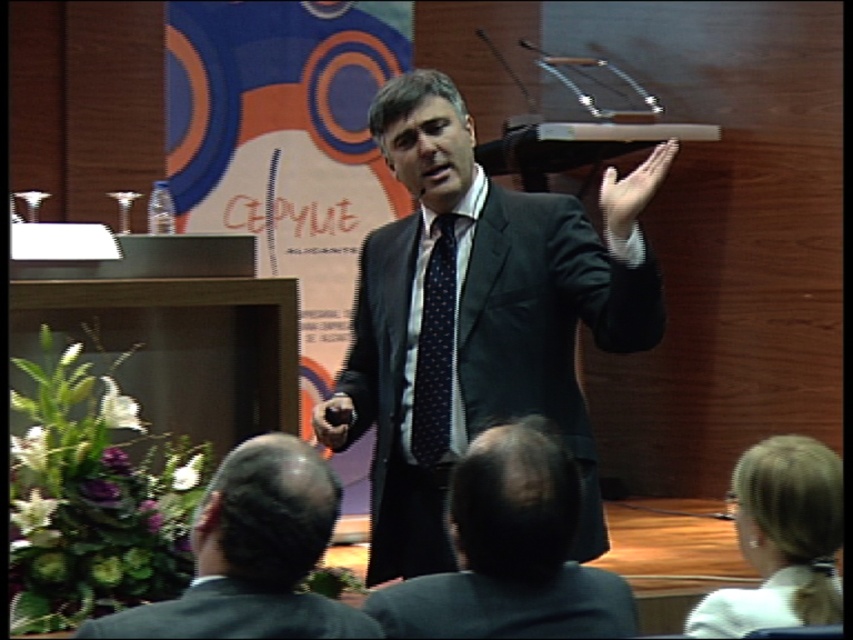
You are an event organizer who needs to adjust the seating arrangement for the presenter. Since the presenter is wearing a black suit at center and a dark blue dotted fabric tie at center, which item of clothing is closer to the audience?

The black suit at center is closer to the audience because it is in front of the dark blue dotted fabric tie at center.

You are an attendee at the presentation. You notice the dark gray suit at lower left and the matte black hand at upper center. Which object is closer to you?

The dark gray suit at lower left is closer to you because it is in front of the matte black hand at upper center.

You are an event planner observing the presentation setup. You need to ensure that the dark gray suit at lower left and the matte black hand at upper center are positioned correctly for the live stream camera. Which object is positioned to the left of the other?

The dark gray suit at lower left is to the left of matte black hand at upper center.